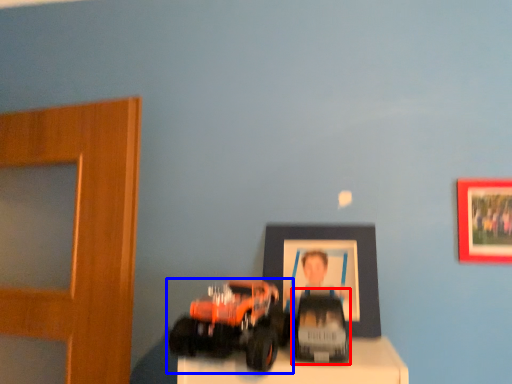
Question: Which of the following is the closest to the observer, toy (highlighted by a red box) or toy (highlighted by a blue box)?

Choices:
 (A) toy
 (B) toy

Answer: (B)